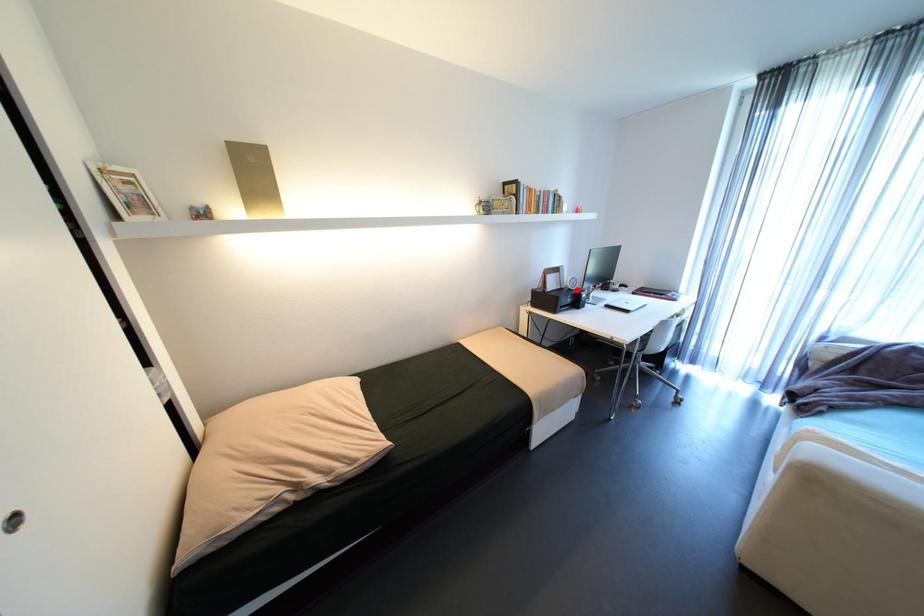
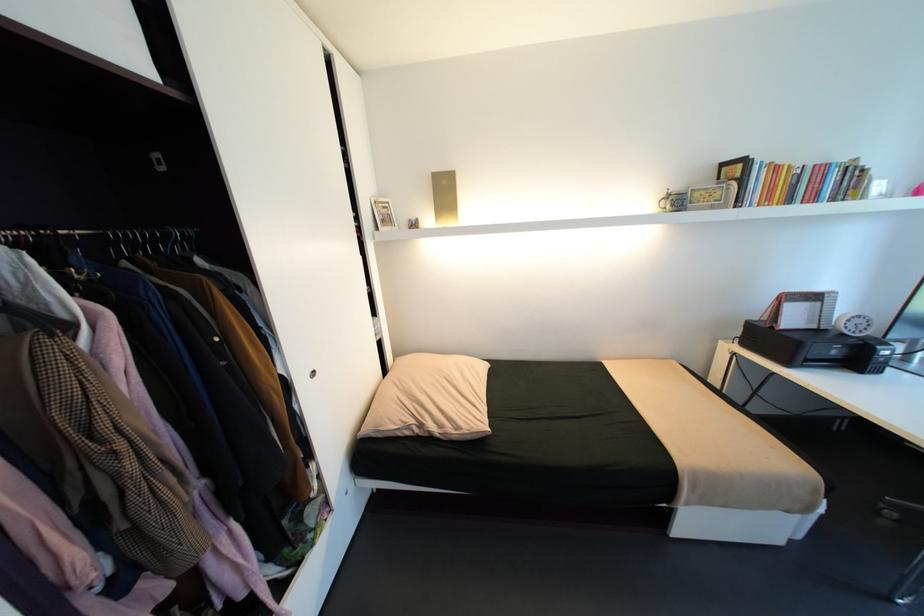
The point at the highlighted location is marked in the first image. Where is the corresponding point in the second image?

(850, 334)